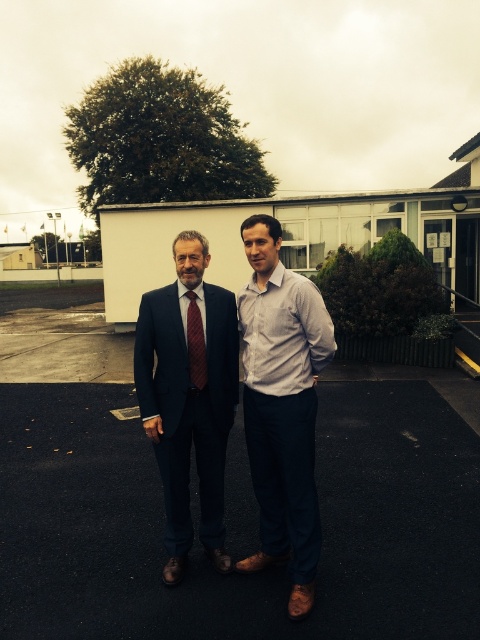
Is point (191, 419) farther from viewer compared to point (204, 381)?

Yes, it is.

Where is `matte black suit at center`? Image resolution: width=480 pixels, height=640 pixels. matte black suit at center is located at coordinates (189, 396).

Does point (253, 561) lie behind point (144, 413)?

Yes, it is behind point (144, 413).

Which is behind, point (310, 552) or point (220, 504)?

The point (220, 504) is behind.

Is point (272, 403) more distant than point (230, 333)?

No, it is in front of (230, 333).

I want to click on light gray cotton shirt at center, so click(x=282, y=404).

Which is behind, point (108, 419) or point (268, 321)?

The point (108, 419) is behind.

Who is positioned more to the right, black asphalt at center or light gray cotton shirt at center?

light gray cotton shirt at center is more to the right.

Find the location of a particular element. The width and height of the screenshot is (480, 640). black asphalt at center is located at coordinates (197, 509).